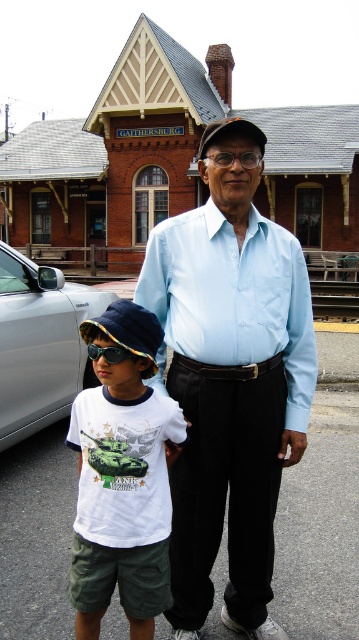
Who is more distant from viewer, (x=133, y=435) or (x=53, y=396)?

Point (x=53, y=396)

Who is positioned more to the right, white cotton shirt at center or silver metallic car at left?

white cotton shirt at center

Find the location of a particular element. This screenshot has width=359, height=640. white cotton shirt at center is located at coordinates (123, 477).

Is light blue shirt at center bigger than blue reflective sunglasses at left?

Correct, light blue shirt at center is larger in size than blue reflective sunglasses at left.

Is light blue shirt at center to the right of blue reflective sunglasses at left from the viewer's perspective?

Yes, light blue shirt at center is to the right of blue reflective sunglasses at left.

Which is behind, point (258, 288) or point (104, 355)?

The point (258, 288) is behind.

Locate an element on the screen. light blue shirt at center is located at coordinates (230, 381).

Is light blue shirt at center closer to camera compared to white cotton shirt at center?

No, light blue shirt at center is further to the viewer.

Which is behind, point (218, 348) or point (110, 392)?

The point (218, 348) is behind.

Where is `light blue shirt at center`? The width and height of the screenshot is (359, 640). light blue shirt at center is located at coordinates (230, 381).

Where is `light blue shirt at center`? light blue shirt at center is located at coordinates (230, 381).